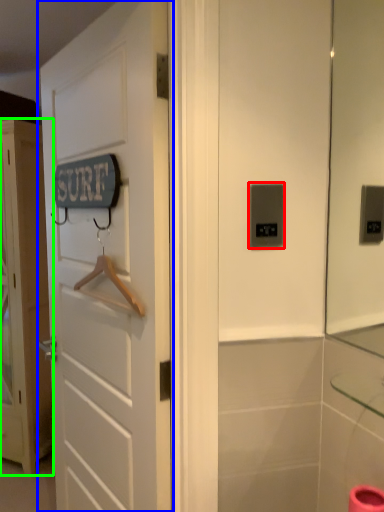
Question: Estimate the real-world distances between objects in this image. Which object is farther from light switch (highlighted by a red box), door (highlighted by a blue box) or door (highlighted by a green box)?

Choices:
 (A) door
 (B) door

Answer: (B)